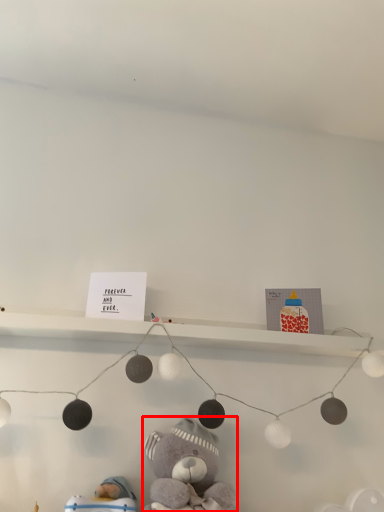
Question: From the image's perspective, where is teddy bear (annotated by the red box) located relative to toy?

Choices:
 (A) below
 (B) above

Answer: (B)